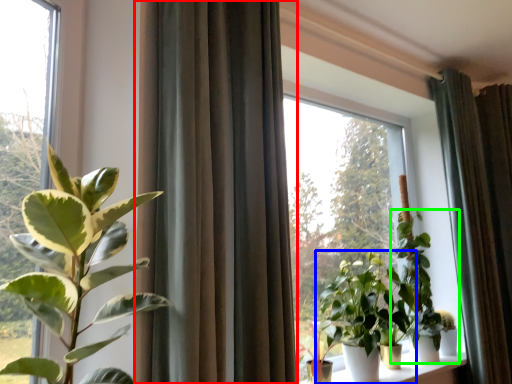
Question: Which object is positioned closest to curtain (highlighted by a red box)? Select from houseplant (highlighted by a blue box) and houseplant (highlighted by a green box).

Choices:
 (A) houseplant
 (B) houseplant

Answer: (A)